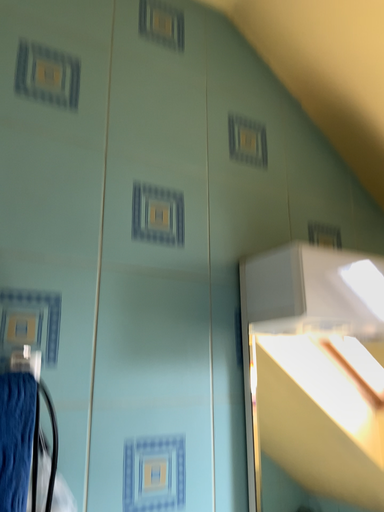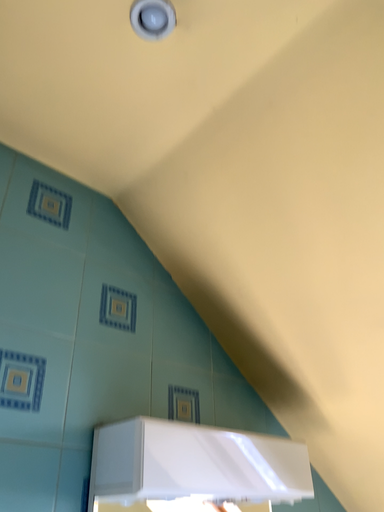
Question: How did the camera likely rotate when shooting the video?

Choices:
 (A) rotated upward
 (B) rotated downward

Answer: (A)